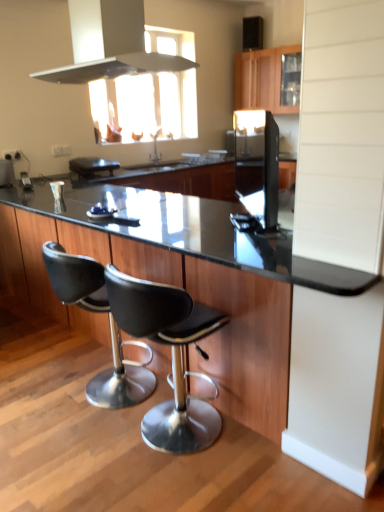
Find the location of a particular element. The width and height of the screenshot is (384, 512). free space that is to the left of black leather stool at center, placed as the first chair when sorted from left to right is located at coordinates pos(33,390).